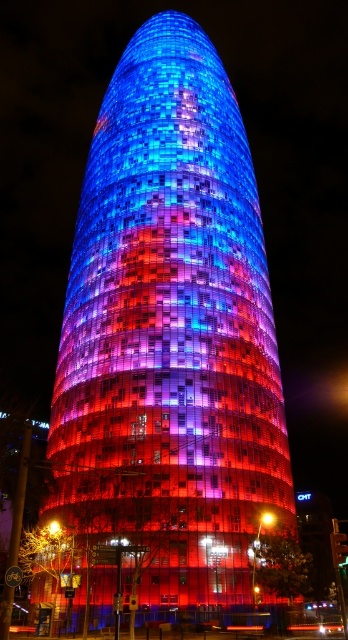
Is shiny glass tower at center smaller than matte glass light at center?

Incorrect, shiny glass tower at center is not smaller in size than matte glass light at center.

Between point (195, 464) and point (272, 516), which one is positioned behind?

The point (272, 516) is more distant.

I want to click on shiny glass tower at center, so click(x=169, y=348).